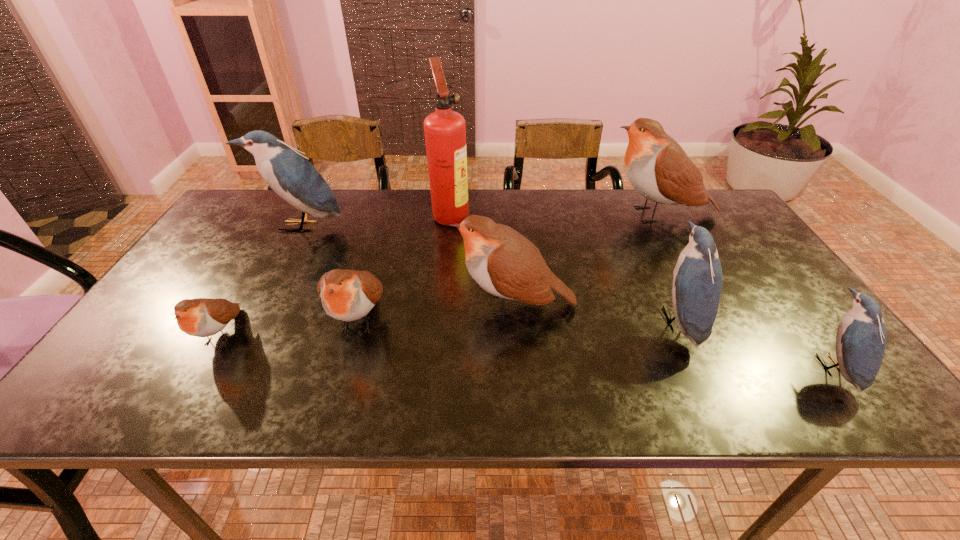
Locate which bird is the closest to the fourth bird from left to right. Please provide its 2D coordinates. Your answer should be formatted as a tuple, i.e. [(x, y)], where the tuple contains the x and y coordinates of a point satisfying the conditions above.

[(347, 295)]

At what (x,y) coordinates should I click in order to perform the action: click on brown bird that is the third closest to the farthest brown bird. Please return your answer as a coordinate pair (x, y). Image resolution: width=960 pixels, height=540 pixels. Looking at the image, I should click on (201, 317).

Select which brown bird is the third closest to the leftmost blue bird. Please provide its 2D coordinates. Your answer should be formatted as a tuple, i.e. [(x, y)], where the tuple contains the x and y coordinates of a point satisfying the conditions above.

[(503, 262)]

Locate which blue bird is the closest to the third smallest brown bird. Please provide its 2D coordinates. Your answer should be formatted as a tuple, i.e. [(x, y)], where the tuple contains the x and y coordinates of a point satisfying the conditions above.

[(697, 277)]

Choose which blue bird is the second nearest neighbor to the shortest bird. Please provide its 2D coordinates. Your answer should be formatted as a tuple, i.e. [(x, y)], where the tuple contains the x and y coordinates of a point satisfying the conditions above.

[(697, 277)]

Identify the location of free space that satisfies the following two spatial constraints: 1. at the face of the farthest brown bird; 2. at the face of the smallest brown bird. (726, 335).

Identify the location of vacant region that satisfies the following two spatial constraints: 1. at the tip of the second blue bird from left to right's beak; 2. at the face of the smallest brown bird. The width and height of the screenshot is (960, 540). (684, 335).

What are the coordinates of `free location that satisfies the following two spatial constraints: 1. on the front-facing side of the red fire extinguisher; 2. at the face of the second smallest brown bird` in the screenshot? It's located at click(x=440, y=319).